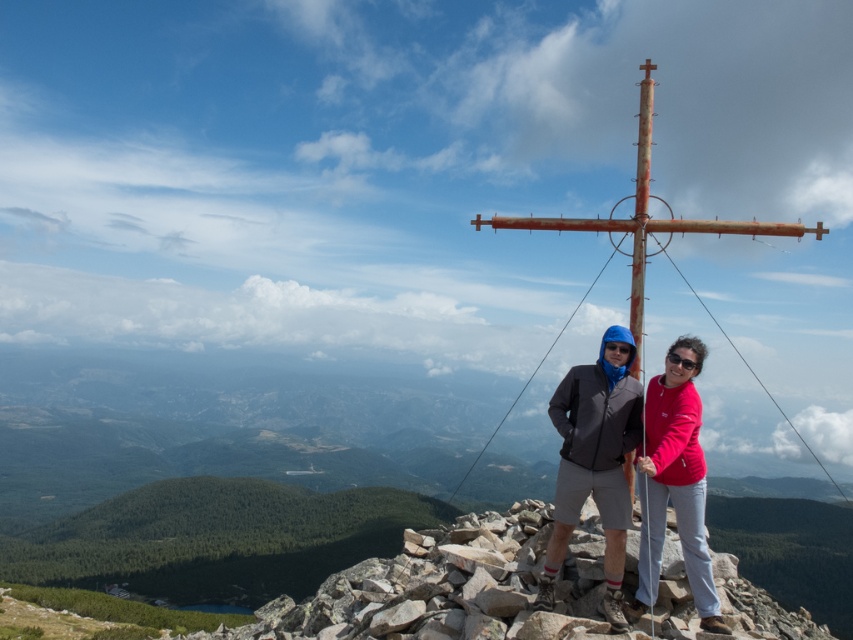
You are a photographer planning to capture a group photo of the matte gray jacket at center and the matte pink sweatshirt at center. Given their sizes, which one should you position closer to the camera to ensure both appear proportionally sized in the photo?

The matte gray jacket at center is wider than the matte pink sweatshirt at center. To make them appear proportionally sized, position the wider matte gray jacket at center farther from the camera and the narrower matte pink sweatshirt at center closer. This way, perspective will reduce the apparent size of the wider jacket, balancing their sizes in the photo.

You are a photographer at the mountain summit. You want to capture a photo of the large metal cross structure. You are currently at a point labeled as point (683, 424). The recommended minimum distance for capturing clear photos of the cross is 50 feet. Can you take a clear photo of the cross from your current position?

The distance of point (683, 424) from camera is 48.37 feet, which is less than the recommended 50 feet minimum distance. Therefore, you cannot take a clear photo of the cross from your current position.